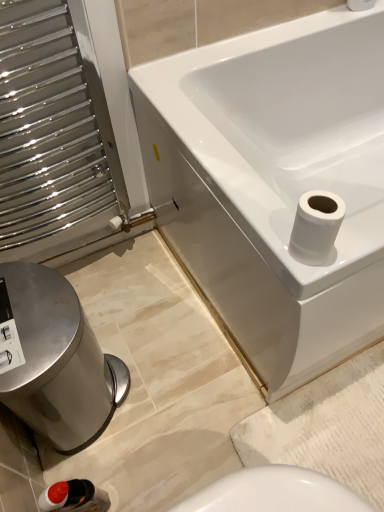
In order to click on vacant space behind white glossy toilet paper at upper right, which is counted as the first toilet paper, starting from the left in this screenshot , I will do `click(254, 196)`.